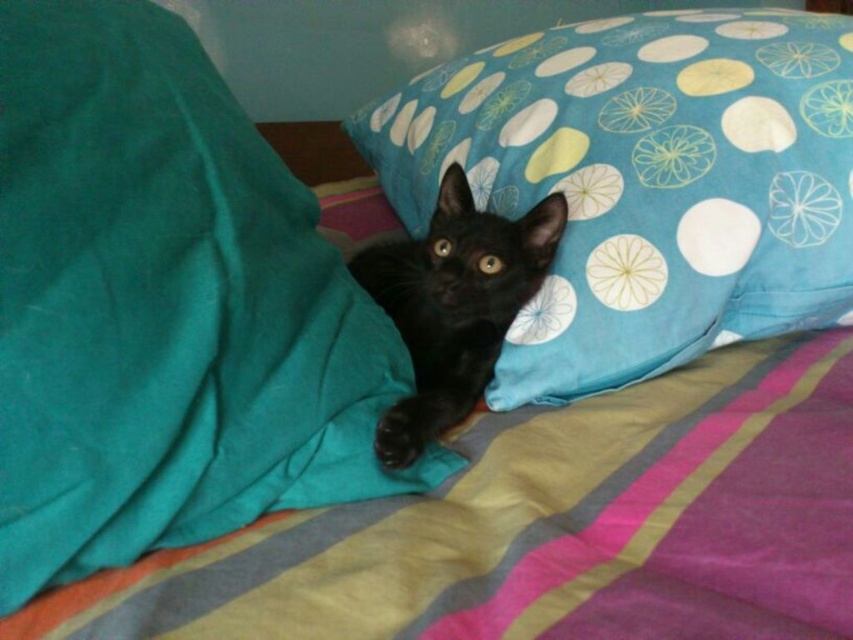
Question: Which object is farther from the camera taking this photo?

Choices:
 (A) black glossy cat at center
 (B) blue dotted pillow at upper right

Answer: (B)

Question: Which of the following is the farthest from the observer?

Choices:
 (A) pos(595,29)
 (B) pos(384,454)

Answer: (A)

Question: In this image, where is blue dotted pillow at upper right located relative to black glossy cat at center?

Choices:
 (A) left
 (B) right

Answer: (B)

Question: Does blue dotted pillow at upper right appear over black glossy cat at center?

Choices:
 (A) yes
 (B) no

Answer: (A)

Question: Considering the relative positions of blue dotted pillow at upper right and black glossy cat at center in the image provided, where is blue dotted pillow at upper right located with respect to black glossy cat at center?

Choices:
 (A) below
 (B) above

Answer: (B)